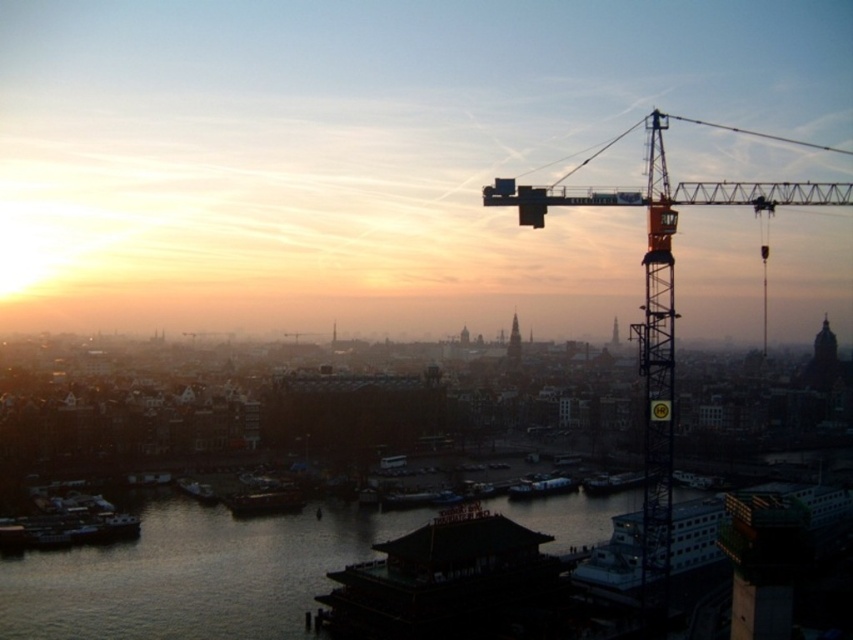
Can you confirm if wooden boat at lower center is positioned to the left of metallic gray boat at lower center?

Correct, you'll find wooden boat at lower center to the left of metallic gray boat at lower center.

From the picture: Is wooden boat at lower center smaller than metallic gray boat at lower center?

No, wooden boat at lower center is not smaller than metallic gray boat at lower center.

Does point (260, 515) come closer to viewer compared to point (593, 476)?

That is True.

Locate an element on the screen. The height and width of the screenshot is (640, 853). wooden boat at lower center is located at coordinates (265, 500).

Measure the distance from dark water at lower center to white plastic boat at center.

dark water at lower center is 97.21 feet from white plastic boat at center.

I want to click on dark water at lower center, so click(192, 573).

I want to click on dark water at lower center, so click(192, 573).

Does dark water at lower center have a larger size compared to metallic silver boat at center?

Yes.

Is dark water at lower center below metallic silver boat at center?

No, dark water at lower center is not below metallic silver boat at center.

Which is behind, point (321, 561) or point (409, 500)?

The point (409, 500) is behind.

Find the location of a particular element. dark water at lower center is located at coordinates (192, 573).